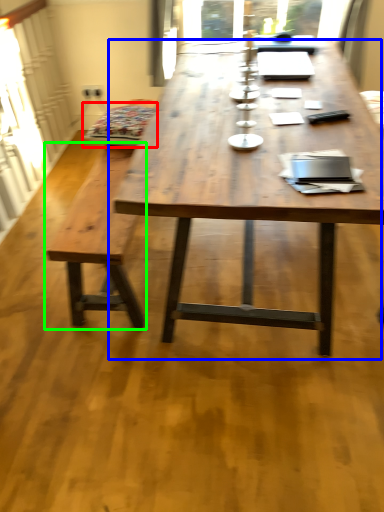
Question: Which object is the closest to the swivel chair (highlighted by a red box)? Choose among these: coffee table (highlighted by a blue box) or bench (highlighted by a green box).

Choices:
 (A) coffee table
 (B) bench

Answer: (B)